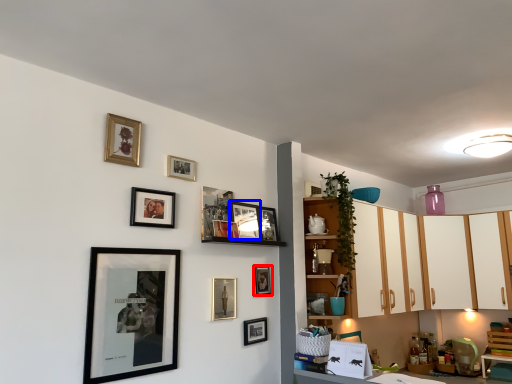
Question: Among these objects, which one is nearest to the camera, picture frame (highlighted by a red box) or picture frame (highlighted by a blue box)?

Choices:
 (A) picture frame
 (B) picture frame

Answer: (B)